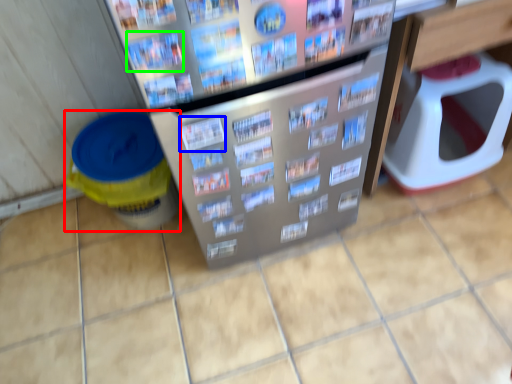
Question: Considering the real-world distances, which object is farthest from recycling bin (highlighted by a red box)? magazine (highlighted by a blue box) or magazine (highlighted by a green box)?

Choices:
 (A) magazine
 (B) magazine

Answer: (B)